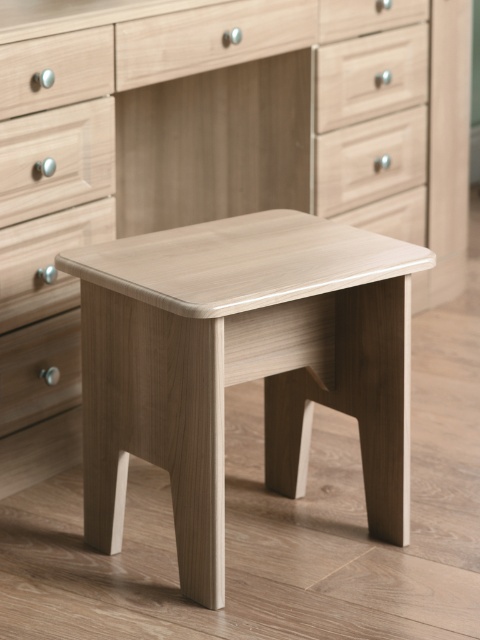
Question: Which point is closer to the camera?

Choices:
 (A) (0, 346)
 (B) (59, 118)

Answer: (B)

Question: Is matte wood drawer at upper right to the right of matte wood drawer at center from the viewer's perspective?

Choices:
 (A) no
 (B) yes

Answer: (A)

Question: Is light wood drawer at upper left wider than matte wood drawer at lower left?

Choices:
 (A) yes
 (B) no

Answer: (A)

Question: Estimate the real-world distances between objects in this image. Which object is farther from the light wood drawer at upper left?

Choices:
 (A) matte wood drawer at upper left
 (B) matte wood drawer at lower left
 (C) light wood drawer at center

Answer: (B)

Question: Which of the following is the farthest from the observer?

Choices:
 (A) (389, 208)
 (B) (54, 65)

Answer: (A)

Question: Is matte wood drawer at upper right thinner than light brown wood drawer at center?

Choices:
 (A) yes
 (B) no

Answer: (B)